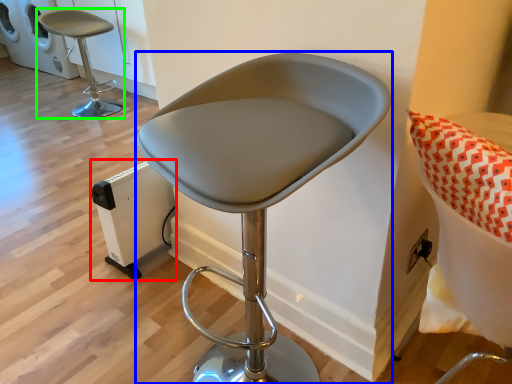
Question: Based on their relative distances, which object is nearer to appliance (highlighted by a red box)? Choose from chair (highlighted by a blue box) and chair (highlighted by a green box).

Choices:
 (A) chair
 (B) chair

Answer: (A)